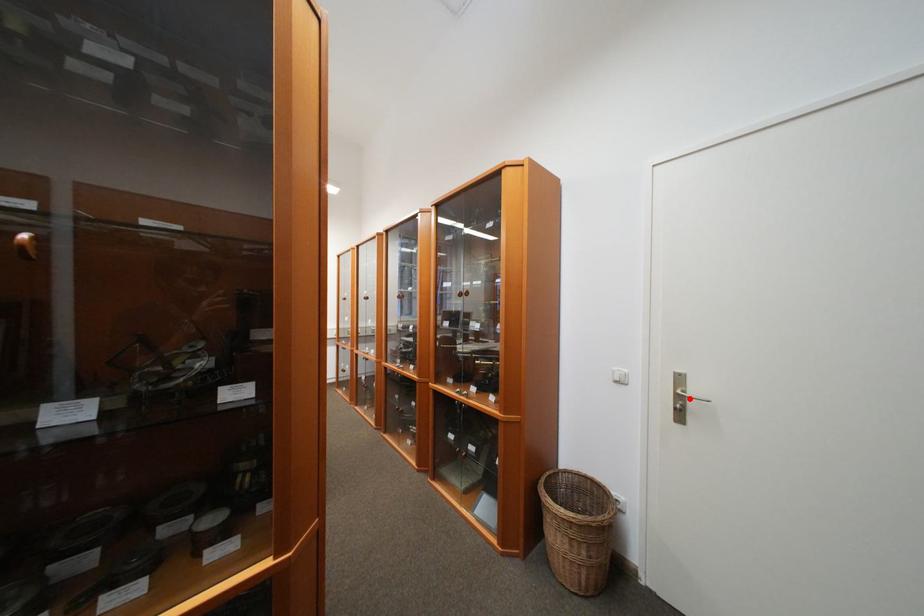
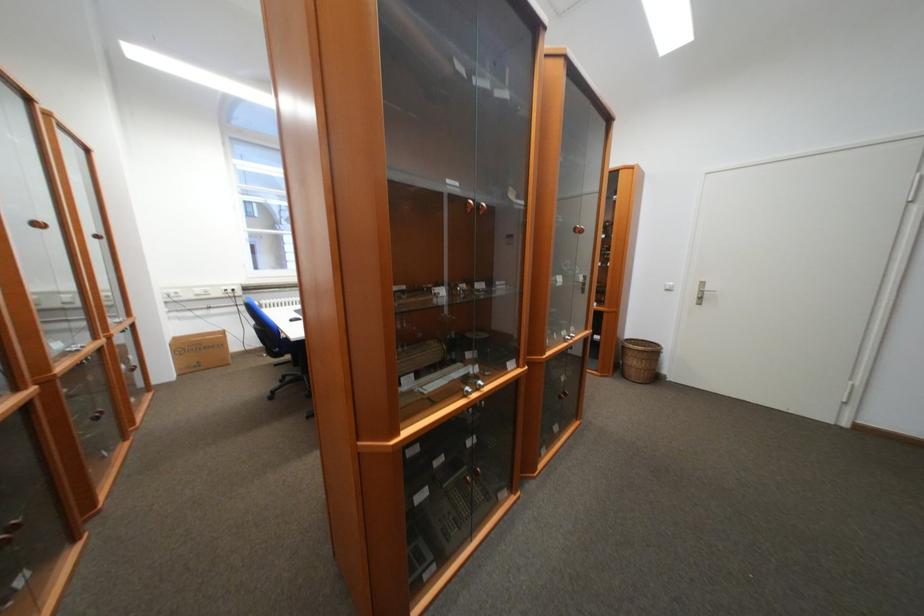
Find the pixel in the second image that matches the highlighted location in the first image.

(711, 293)